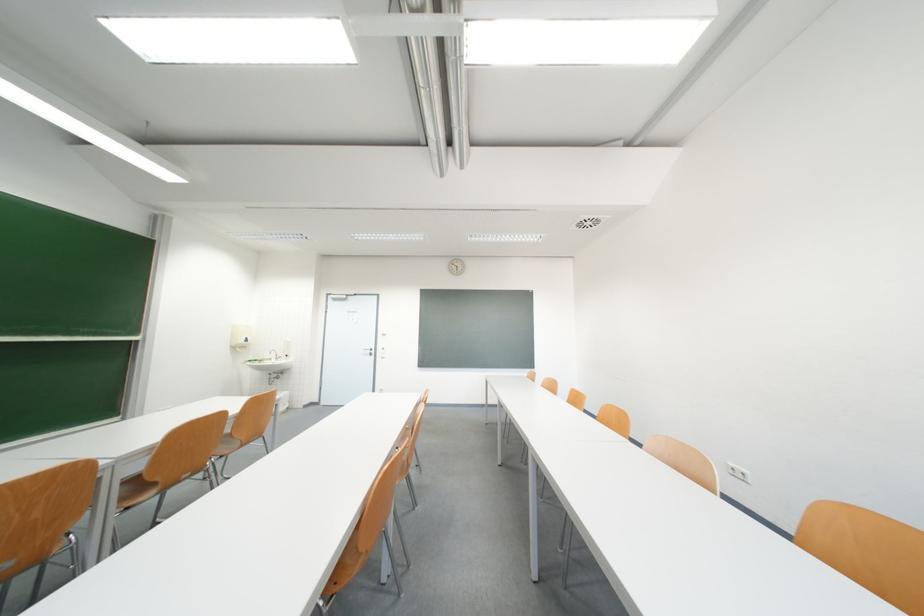
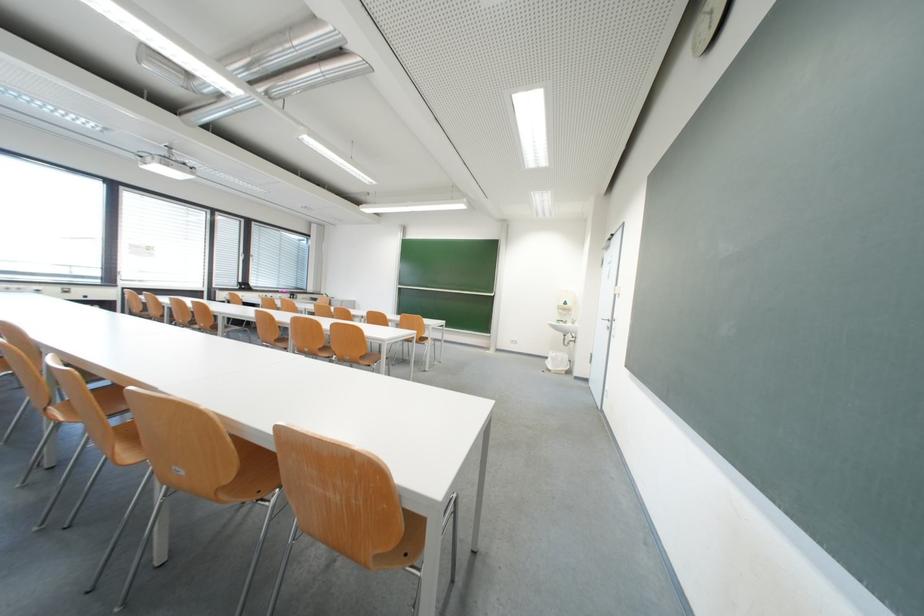
Locate, in the second image, the point that corresponds to point (265, 365) in the first image.

(570, 326)